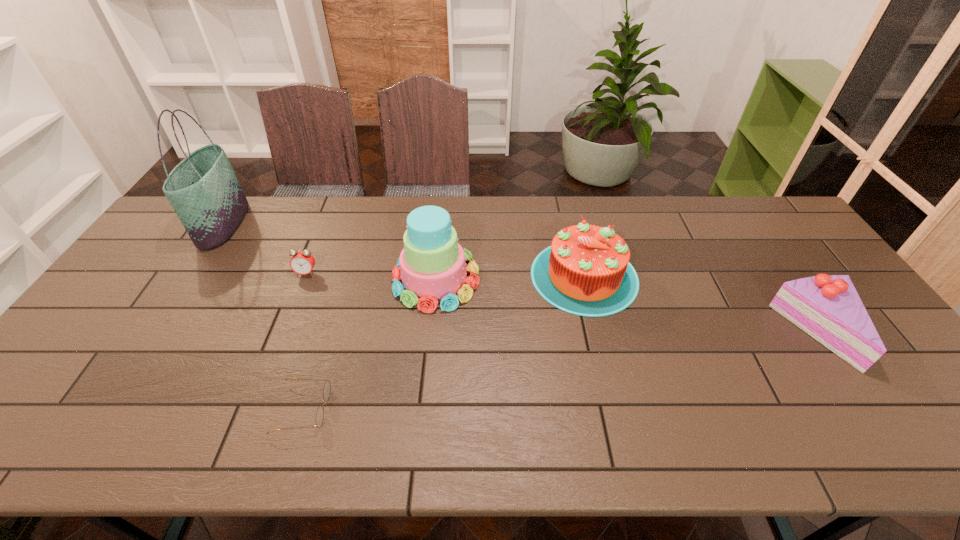
Where is `the nearest object`? This screenshot has width=960, height=540. the nearest object is located at coordinates [x=327, y=387].

Locate an element on the screen. the fourth object from right to left is located at coordinates (327, 387).

Where is `vacant space situated on the front of the leftmost object`? vacant space situated on the front of the leftmost object is located at coordinates 182,287.

This screenshot has width=960, height=540. Find the location of `vacant position located 0.370m on the right of the leftmost cake`. vacant position located 0.370m on the right of the leftmost cake is located at coordinates (605, 279).

You are a GUI agent. You are given a task and a screenshot of the screen. Output one action in this format:
    pyautogui.click(x=<x>, y=<y>)
    Task: Click on the vacant space positioned 0.200m on the back of the second tallest cake
    The height and width of the screenshot is (540, 960).
    Given the screenshot: What is the action you would take?
    pyautogui.click(x=567, y=205)

Identify the location of free space located on the front of the shortest cake. The height and width of the screenshot is (540, 960). (892, 437).

Where is `free space located 0.180m on the front-facing side of the second shortest object`? Image resolution: width=960 pixels, height=540 pixels. free space located 0.180m on the front-facing side of the second shortest object is located at coordinates (286, 326).

Find the location of a particular element. This screenshot has width=960, height=540. vacant space located 0.210m on the temples of the shortest object is located at coordinates (420, 409).

Where is `object situated at the far edge`? object situated at the far edge is located at coordinates (203, 189).

At what (x,y) coordinates should I click in order to perform the action: click on object that is at the near edge. Please return your answer as a coordinate pair (x, y). Looking at the image, I should click on (327, 387).